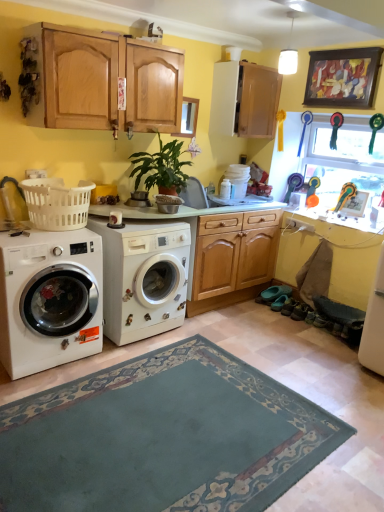
At what (x,y) coordinates should I click in order to perform the action: click on white plastic laundry basket at left. Please return your answer as a coordinate pair (x, y). Image resolution: width=384 pixels, height=512 pixels. Looking at the image, I should click on (57, 203).

What do you see at coordinates (50, 298) in the screenshot? The image size is (384, 512). I see `white matte washing machine at left, which is counted as the 1th washing machine, starting from the left` at bounding box center [50, 298].

Where is `white matte washing machine at left, which is counted as the 1th washing machine, starting from the left`? This screenshot has width=384, height=512. white matte washing machine at left, which is counted as the 1th washing machine, starting from the left is located at coordinates (50, 298).

Describe the element at coordinates (329, 218) in the screenshot. Image resolution: width=384 pixels, height=512 pixels. I see `white glossy counter top at lower right` at that location.

Identify the location of white glossy counter top at lower right. The image size is (384, 512). (329, 218).

Locate an element on the screen. Image resolution: width=384 pixels, height=512 pixels. translucent plastic window screen at upper right is located at coordinates (345, 157).

Describe the element at coordinates (345, 157) in the screenshot. Image resolution: width=384 pixels, height=512 pixels. I see `translucent plastic window screen at upper right` at that location.

Identify the location of white plastic laundry basket at left. (57, 203).

Which object is positioned more to the left, translucent plastic window screen at upper right or white glossy counter top at lower right?

white glossy counter top at lower right is more to the left.

Based on the photo, from a real-world perspective, is translucent plastic window screen at upper right on top of white glossy counter top at lower right?

Yes, from a real-world perspective, translucent plastic window screen at upper right is over white glossy counter top at lower right

Does translucent plastic window screen at upper right lie in front of white glossy counter top at lower right?

No, translucent plastic window screen at upper right is further to the viewer.

Is wooden cabinet at upper center positioned with its back to translucent plastic window screen at upper right?

That's not correct — wooden cabinet at upper center is not looking away from translucent plastic window screen at upper right.

Is point (240, 61) closer to viewer compared to point (363, 144)?

That is True.

Which is in front, wooden cabinet at upper center or translucent plastic window screen at upper right?

wooden cabinet at upper center is closer to the camera.

From the picture: From the image's perspective, is wooden cabinet at upper center located beneath translucent plastic window screen at upper right?

→ No, from the image's perspective, wooden cabinet at upper center is not below translucent plastic window screen at upper right.

From a real-world perspective, between white matte washing machine at left, arranged as the second washing machine when viewed from the right, and white matte washing machine at center, positioned as the 2th washing machine in left-to-right order, who is vertically higher?

white matte washing machine at left, arranged as the second washing machine when viewed from the right, from a real-world perspective.

From the image's perspective, which is above, white matte washing machine at left, which is counted as the 1th washing machine, starting from the left, or white matte washing machine at center, positioned as the 2th washing machine in left-to-right order?

white matte washing machine at center, positioned as the 2th washing machine in left-to-right order, appears higher in the image.

Which of these two, white matte washing machine at left, arranged as the second washing machine when viewed from the right, or white matte washing machine at center, marked as the 1th washing machine in a right-to-left arrangement, stands taller?

white matte washing machine at center, marked as the 1th washing machine in a right-to-left arrangement.

Is the surface of wooden cabinet at upper center in direct contact with white glossy counter top at lower right?

wooden cabinet at upper center and white glossy counter top at lower right are not in contact.

From the image's perspective, is wooden cabinet at upper center on white glossy counter top at lower right?

Yes.

Who is bigger, wooden cabinet at upper center or white glossy counter top at lower right?

wooden cabinet at upper center is bigger.

Is wooden cabinet at upper center facing towards white glossy counter top at lower right?

No, wooden cabinet at upper center is not aimed at white glossy counter top at lower right.

Consider the image. Can you confirm if translucent plastic window screen at upper right is taller than wooden cabinet at upper center?

Yes, translucent plastic window screen at upper right is taller than wooden cabinet at upper center.

Is translucent plastic window screen at upper right next to wooden cabinet at upper center?

No.

From the image's perspective, which one is positioned lower, translucent plastic window screen at upper right or wooden cabinet at upper center?

translucent plastic window screen at upper right appears lower in the image.

Is translucent plastic window screen at upper right oriented away from wooden cabinet at upper center?

No, wooden cabinet at upper center is not at the back of translucent plastic window screen at upper right.

From a real-world perspective, is white glossy counter top at lower right physically above white matte washing machine at center, marked as the 1th washing machine in a right-to-left arrangement?

Yes, from a real-world perspective, white glossy counter top at lower right is on top of white matte washing machine at center, marked as the 1th washing machine in a right-to-left arrangement.

Is white glossy counter top at lower right not close to white matte washing machine at center, marked as the 1th washing machine in a right-to-left arrangement?

Indeed, white glossy counter top at lower right is not near white matte washing machine at center, marked as the 1th washing machine in a right-to-left arrangement.

Between white glossy counter top at lower right and white matte washing machine at center, marked as the 1th washing machine in a right-to-left arrangement, which one appears on the left side from the viewer's perspective?

Positioned to the left is white matte washing machine at center, marked as the 1th washing machine in a right-to-left arrangement.

Considering the positions of points (319, 204) and (115, 289), is point (319, 204) farther from camera compared to point (115, 289)?

That is True.

Is green matte plant at center closer to camera compared to wooden cabinet at upper center?

That is True.

What's the angular difference between green matte plant at center and wooden cabinet at upper center's facing directions?

green matte plant at center and wooden cabinet at upper center are facing 1.41 degrees away from each other.

Which of these two, green matte plant at center or wooden cabinet at upper center, is thinner?

With smaller width is wooden cabinet at upper center.

At what (x,y) coordinates should I click in order to perform the action: click on plant in front of the wooden cabinet at upper center. Please return your answer as a coordinate pair (x, y). Looking at the image, I should click on (161, 168).

Identify the location of counter top lying on the left of translucent plastic window screen at upper right. (329, 218).

Identify the location of cabinetry that is above the translucent plastic window screen at upper right (from a real-world perspective). The height and width of the screenshot is (512, 384). (244, 100).

Considering their positions, is white glossy counter top at lower right positioned further to white matte washing machine at center, positioned as the 2th washing machine in left-to-right order, than white plastic laundry basket at left?

white glossy counter top at lower right is positioned further to the anchor white matte washing machine at center, positioned as the 2th washing machine in left-to-right order.

Which object lies further to the anchor point white plastic laundry basket at left, white matte washing machine at left, which is counted as the 1th washing machine, starting from the left, or white matte washing machine at center, positioned as the 2th washing machine in left-to-right order?

white matte washing machine at center, positioned as the 2th washing machine in left-to-right order, is positioned further to the anchor white plastic laundry basket at left.

Looking at the image, which one is located further to white matte washing machine at left, which is counted as the 1th washing machine, starting from the left, white glossy counter top at lower right or wooden cabinet at upper center?

white glossy counter top at lower right is positioned further to the anchor white matte washing machine at left, which is counted as the 1th washing machine, starting from the left.

Considering their positions, is translucent plastic window screen at upper right positioned further to white plastic laundry basket at left than white matte washing machine at left, which is counted as the 1th washing machine, starting from the left?

translucent plastic window screen at upper right lies further to white plastic laundry basket at left than the other object.

Looking at the image, which one is located further to white glossy counter top at lower right, white plastic laundry basket at left or translucent plastic window screen at upper right?

Among the two, white plastic laundry basket at left is located further to white glossy counter top at lower right.

Looking at the image, which one is located closer to translucent plastic window screen at upper right, wooden cabinet at upper center or white matte washing machine at left, arranged as the second washing machine when viewed from the right?

wooden cabinet at upper center.

Based on their spatial positions, is white matte washing machine at center, marked as the 1th washing machine in a right-to-left arrangement, or green matte plant at center closer to translucent plastic window screen at upper right?

The object closer to translucent plastic window screen at upper right is green matte plant at center.

Looking at the image, which one is located closer to white plastic laundry basket at left, white glossy counter top at lower right or green matte plant at center?

Among the two, green matte plant at center is located nearer to white plastic laundry basket at left.

I want to click on basket between wooden cabinet at upper center and white matte washing machine at center, positioned as the 2th washing machine in left-to-right order, from top to bottom, so click(57, 203).

Identify the location of window screen between wooden cabinet at upper center and white glossy counter top at lower right from top to bottom. (345, 157).

The width and height of the screenshot is (384, 512). I want to click on cabinetry located between green matte plant at center and translucent plastic window screen at upper right in the left-right direction, so click(x=244, y=100).

Find the location of a particular element. Image resolution: width=384 pixels, height=512 pixels. washing machine that lies between green matte plant at center and white matte washing machine at left, arranged as the second washing machine when viewed from the right, from top to bottom is located at coordinates (143, 278).